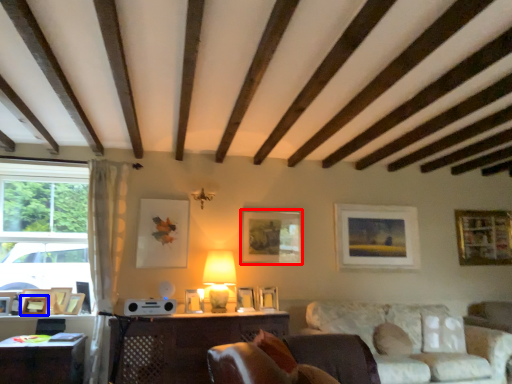
Question: Which object appears farthest to the camera in this image, picture frame (highlighted by a red box) or picture frame (highlighted by a blue box)?

Choices:
 (A) picture frame
 (B) picture frame

Answer: (A)